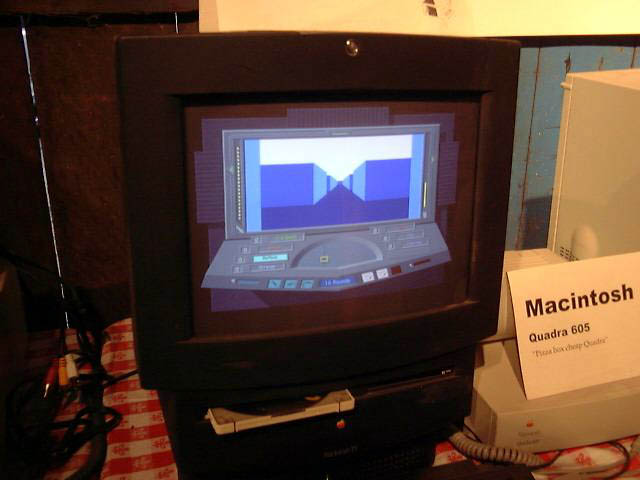
This screenshot has height=480, width=640. In order to click on tablecloth in this screenshot , I will do `click(138, 442)`.